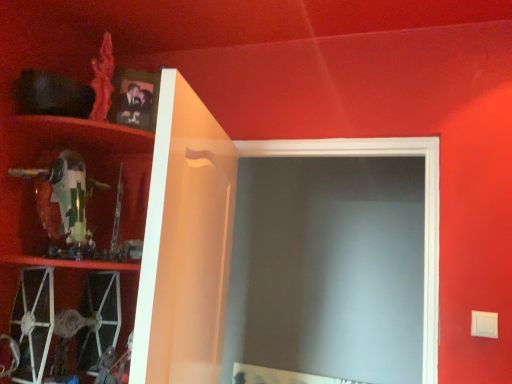
Question: From their relative heights in the image, would you say matte black photo frame at upper left is taller or shorter than white glossy cabinet at upper left, which is the 1th cabinet from right to left?

Choices:
 (A) tall
 (B) short

Answer: (B)

Question: Is matte black photo frame at upper left inside the boundaries of white glossy cabinet at upper left, acting as the third cabinet starting from the left, or outside?

Choices:
 (A) outside
 (B) inside

Answer: (A)

Question: Which of these objects is positioned closest to the green plastic toy at left, placed as the second cabinet when sorted from left to right?

Choices:
 (A) white glossy cabinet at upper left, acting as the third cabinet starting from the left
 (B) matte black photo frame at upper left
 (C) metallic silver tie fighter at lower left, which is counted as the 3th cabinet, starting from the right

Answer: (A)

Question: Which object is positioned farthest from the matte black photo frame at upper left?

Choices:
 (A) green plastic toy at left, placed as the second cabinet when sorted from left to right
 (B) white glossy cabinet at upper left, which is the 1th cabinet from right to left
 (C) metallic silver tie fighter at lower left, the 1th cabinet from the left

Answer: (C)